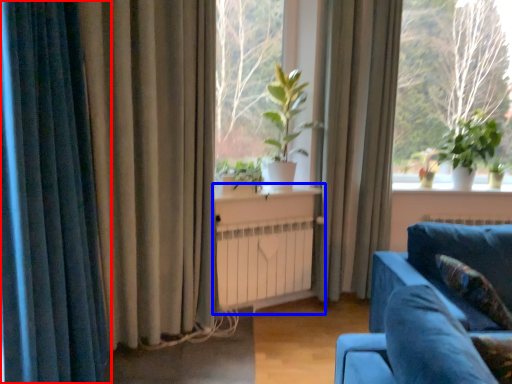
Question: Among these objects, which one is nearest to the camera, curtain (highlighted by a red box) or table (highlighted by a blue box)?

Choices:
 (A) curtain
 (B) table

Answer: (A)